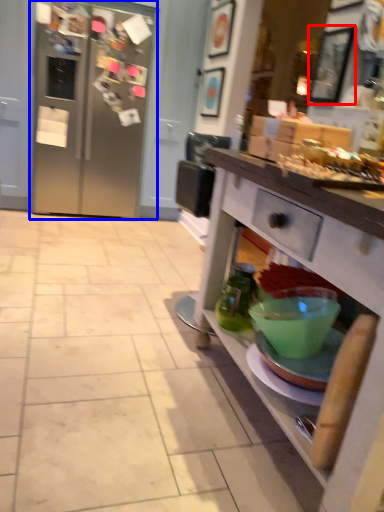
Question: Which of the following is the farthest to the observer, picture frame (highlighted by a red box) or refrigerator (highlighted by a blue box)?

Choices:
 (A) picture frame
 (B) refrigerator

Answer: (B)